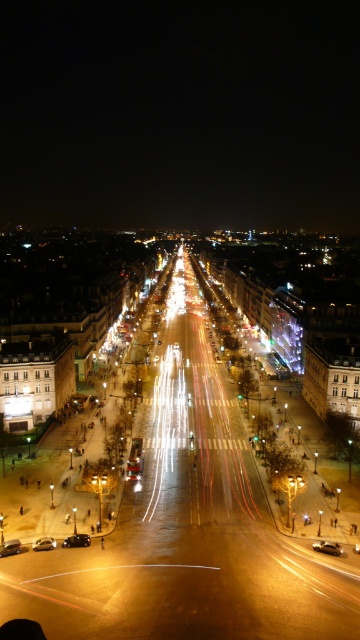
Which of these two, shiny metallic car at center or shiny silver car at center, stands shorter?

shiny metallic car at center

Is shiny metallic car at center below shiny silver car at center?

Indeed, shiny metallic car at center is positioned under shiny silver car at center.

Locate an element on the screen. This screenshot has height=640, width=360. shiny metallic car at center is located at coordinates (327, 547).

Between point (324, 550) and point (74, 540), which one is positioned behind?

Positioned behind is point (74, 540).

Does shiny metallic car at center have a lesser height compared to shiny black car at center?

Yes, shiny metallic car at center is shorter than shiny black car at center.

Find the location of a particular element. Image resolution: width=360 pixels, height=640 pixels. shiny metallic car at center is located at coordinates (327, 547).

Which of these two, shiny black car at center or shiny silver car at center, stands taller?

shiny black car at center

Between point (69, 536) and point (38, 538), which one is positioned in front?

Point (38, 538) is more forward.

Where is `shiny black car at center`? shiny black car at center is located at coordinates (77, 540).